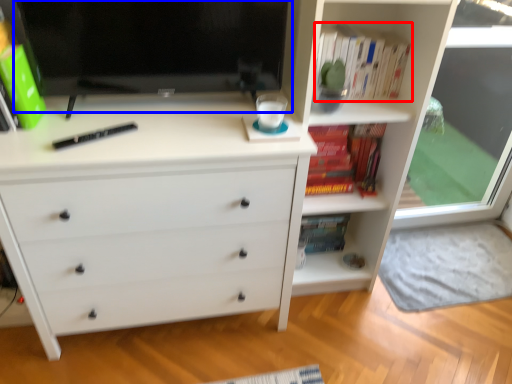
Question: Which point is closer to the camera, book (highlighted by a red box) or computer monitor (highlighted by a blue box)?

Choices:
 (A) book
 (B) computer monitor

Answer: (B)